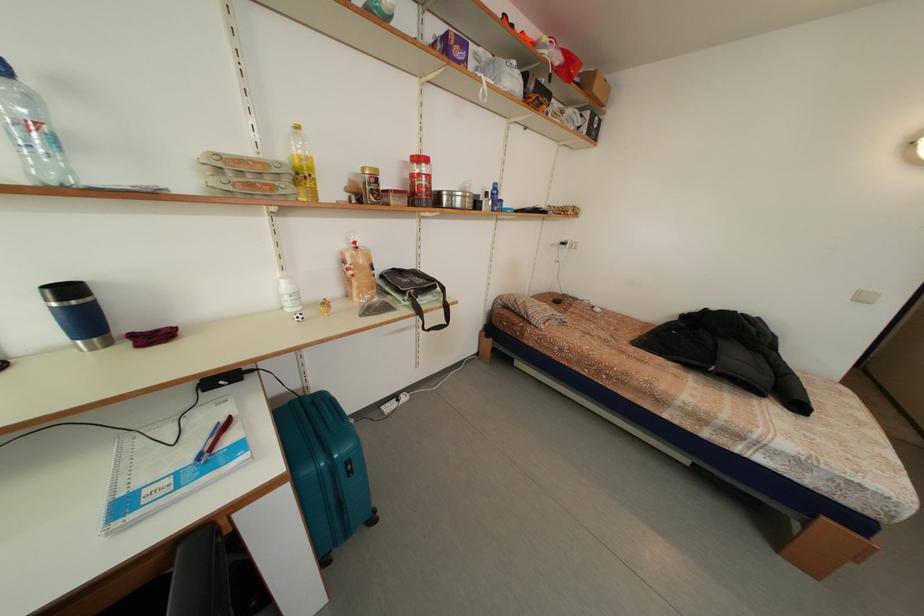
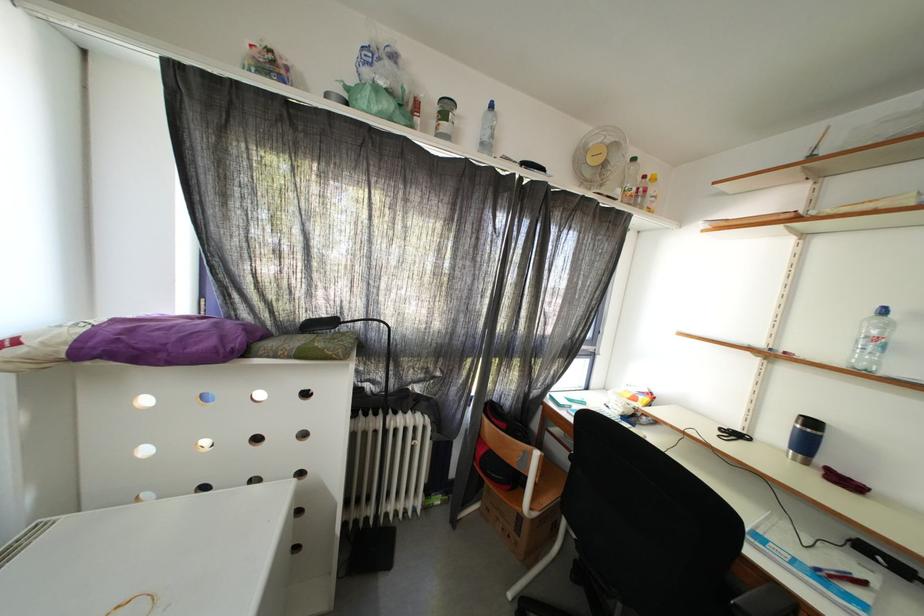
Locate, in the second image, the point that corresponds to pixel 78 296 in the first image.

(820, 429)